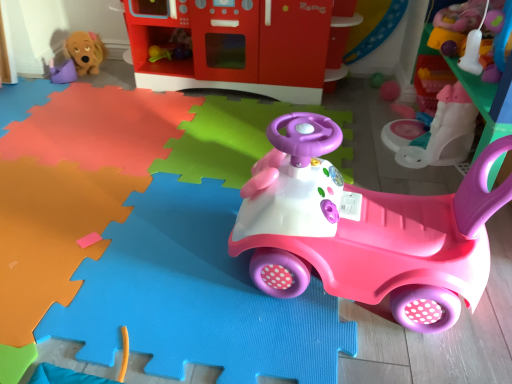
Question: Is pink plastic walker at upper right, which is counted as the fifth toy, starting from the left, bigger or smaller than brown plush dog at upper left, which ranks as the 2th toy in left-to-right order?

Choices:
 (A) big
 (B) small

Answer: (A)

Question: From the image's perspective, is pink plastic walker at upper right, the second toy positioned from the right, located above or below brown plush dog at upper left, which is the fifth toy from right to left?

Choices:
 (A) below
 (B) above

Answer: (A)

Question: Which object is positioned farthest from the matte plastic play kitchen at upper center, which is the 4th toy from right to left?

Choices:
 (A) brown plush dog at upper left, which ranks as the 2th toy in left-to-right order
 (B) matte purple toy at upper left, the 1th toy when ordered from left to right
 (C) smooth plastic toy at upper right, placed as the first toy when sorted from right to left
 (D) pink plastic car at center, the third toy when ordered from right to left
 (E) pink plastic walker at upper right, the second toy positioned from the right

Answer: (D)

Question: Which is nearer to the brown plush dog at upper left, which ranks as the 2th toy in left-to-right order?

Choices:
 (A) smooth plastic toy at upper right, which is the 6th toy in left-to-right order
 (B) pink plastic car at center, which is the fourth toy from left to right
 (C) matte plastic play kitchen at upper center, which is the 4th toy from right to left
 (D) matte purple toy at upper left, which is the sixth toy in right-to-left order
 (E) pink plastic walker at upper right, the second toy positioned from the right

Answer: (D)